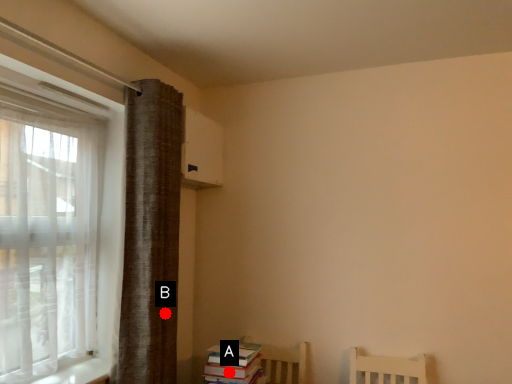
Question: Two points are circled on the image, labeled by A and B beside each circle. Among these points, which one is farthest from the camera?

Choices:
 (A) A is further
 (B) B is further

Answer: (B)